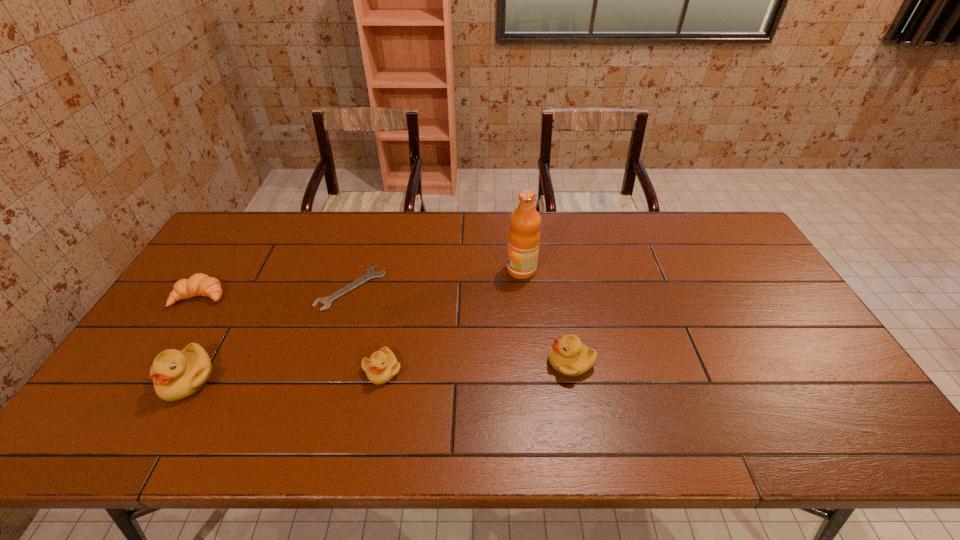
I want to click on vacant point located between the wrench and the fruit juice, so click(437, 279).

Identify the location of vacant point located between the second duckling from left to right and the fifth shortest object. This screenshot has width=960, height=540. (285, 375).

Where is `vacant space that is in between the wrench and the second duckling from left to right`? The image size is (960, 540). vacant space that is in between the wrench and the second duckling from left to right is located at coordinates (367, 329).

This screenshot has width=960, height=540. In order to click on empty space between the tallest duckling and the tallest object in this screenshot , I will do `click(354, 325)`.

The width and height of the screenshot is (960, 540). What are the coordinates of `blank region between the crescent roll and the third tallest object` in the screenshot? It's located at (x=386, y=329).

Select which object appears as the second closest to the fourth tallest object. Please provide its 2D coordinates. Your answer should be formatted as a tuple, i.e. [(x, y)], where the tuple contains the x and y coordinates of a point satisfying the conditions above.

[(176, 375)]

At what (x,y) coordinates should I click in order to perform the action: click on object that is the third closest to the tallest duckling. Please return your answer as a coordinate pair (x, y). Looking at the image, I should click on (382, 366).

Select which duckling appears as the third closest to the fruit juice. Please provide its 2D coordinates. Your answer should be formatted as a tuple, i.e. [(x, y)], where the tuple contains the x and y coordinates of a point satisfying the conditions above.

[(176, 375)]

Locate which duckling ranks in proximity to the shortest object. Please provide its 2D coordinates. Your answer should be formatted as a tuple, i.e. [(x, y)], where the tuple contains the x and y coordinates of a point satisfying the conditions above.

[(382, 366)]

This screenshot has height=540, width=960. In order to click on free space that satisfies the following two spatial constraints: 1. on the label side of the fruit juice; 2. on the front-facing side of the second duckling from right to left in this screenshot , I will do `click(532, 370)`.